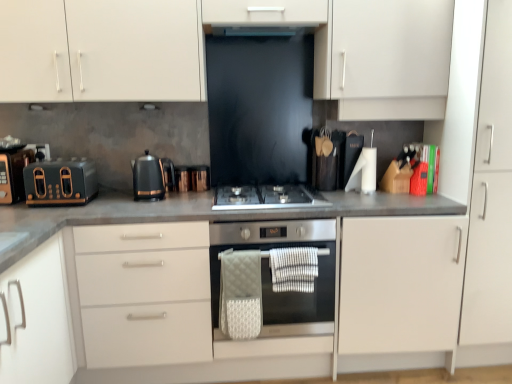
Where is `blank space above white textured hand towel at center, which appears as the second hand towel when viewed from the left (from a real-world perspective)`? This screenshot has width=512, height=384. blank space above white textured hand towel at center, which appears as the second hand towel when viewed from the left (from a real-world perspective) is located at coordinates point(295,251).